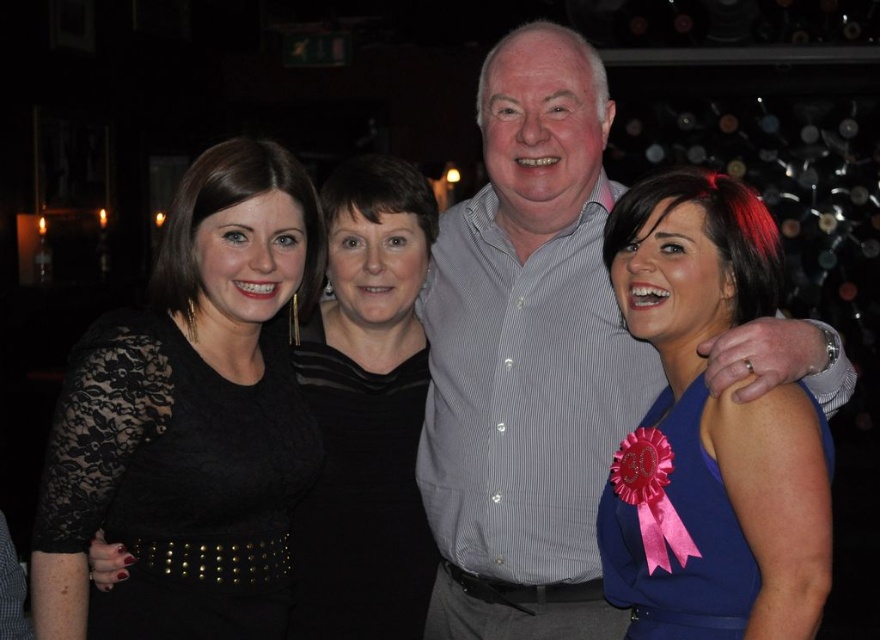
Can you confirm if lace fabric dress at left is thinner than black lace dress at center?

No, lace fabric dress at left is not thinner than black lace dress at center.

Does lace fabric dress at left come behind black lace dress at center?

No.

Who is more distant from viewer, (x=233, y=636) or (x=387, y=481)?

Positioned behind is point (x=387, y=481).

Find the location of `lace fabric dress at left`. lace fabric dress at left is located at coordinates 188,412.

Does gray striped shirt at center have a greater height compared to blue satin dress at center?

Yes.

Who is more forward, (577, 460) or (664, 621)?

Point (664, 621) is more forward.

The width and height of the screenshot is (880, 640). Find the location of `gray striped shirt at center`. gray striped shirt at center is located at coordinates [x=528, y=356].

Is gray striped shirt at center to the left of lace fabric dress at left from the viewer's perspective?

No, gray striped shirt at center is not to the left of lace fabric dress at left.

What do you see at coordinates (528, 356) in the screenshot? I see `gray striped shirt at center` at bounding box center [528, 356].

Image resolution: width=880 pixels, height=640 pixels. I want to click on gray striped shirt at center, so click(x=528, y=356).